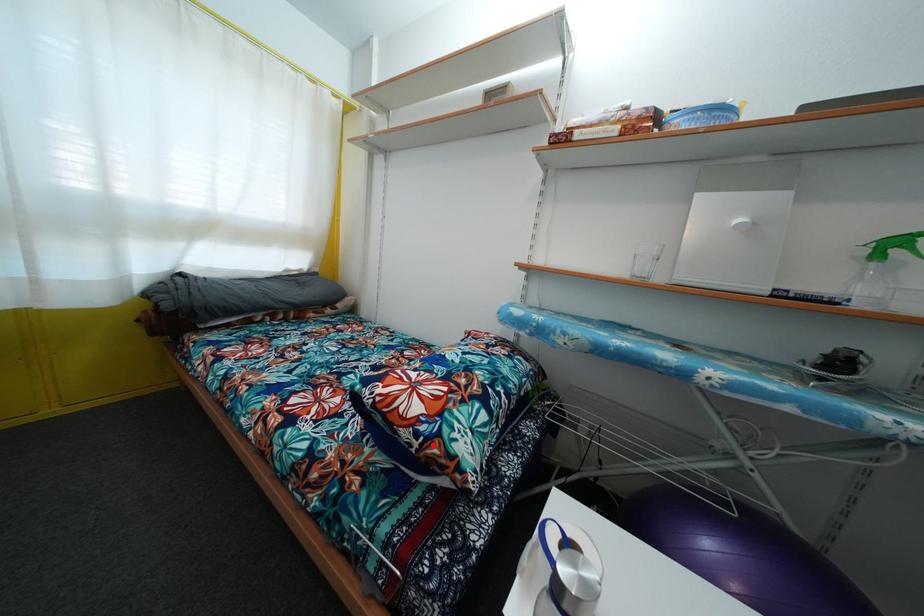
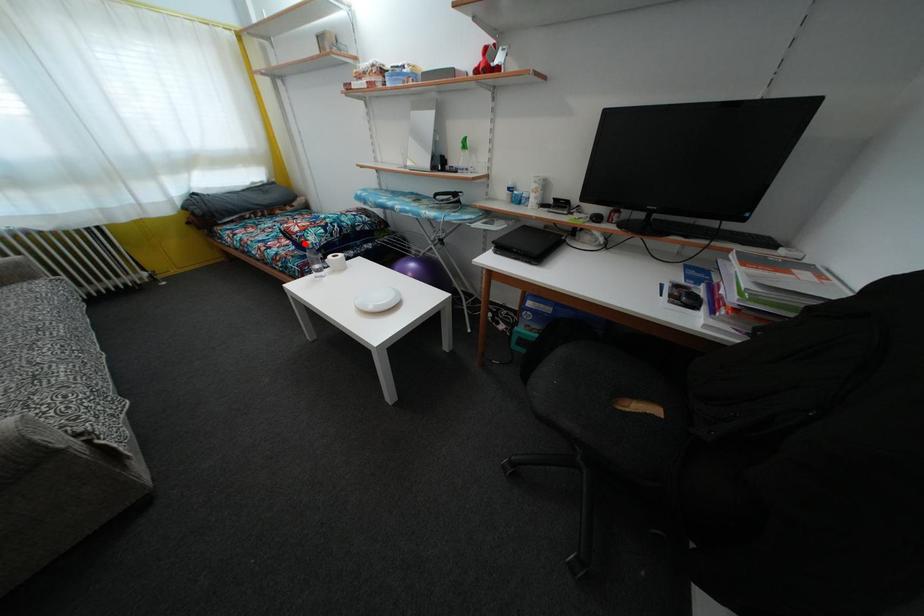
I am providing you with two images of the same scene from different viewpoints. A red point is marked on the first image and another point is marked on the second image. Is the marked point in image1 the same physical position as the marked point in image2?

Yes